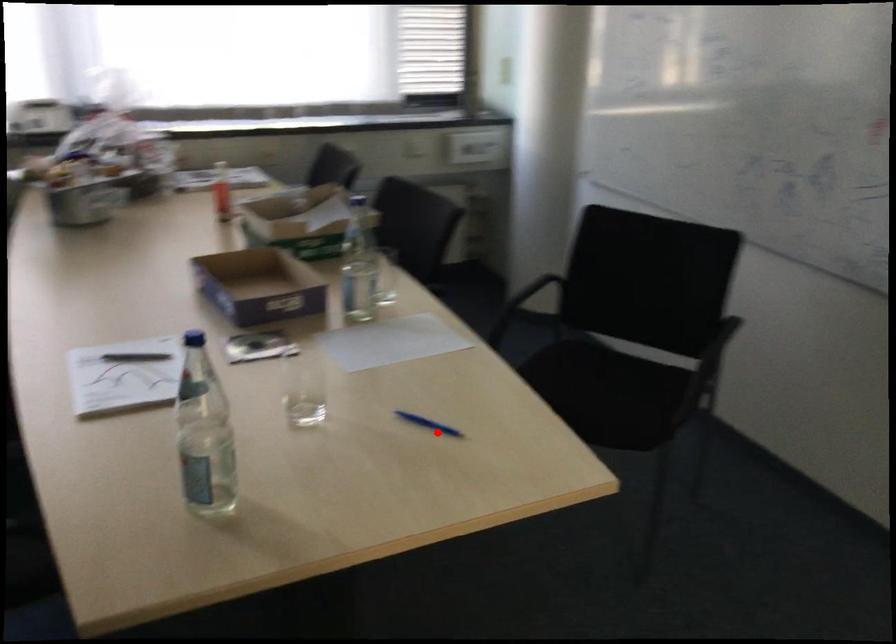
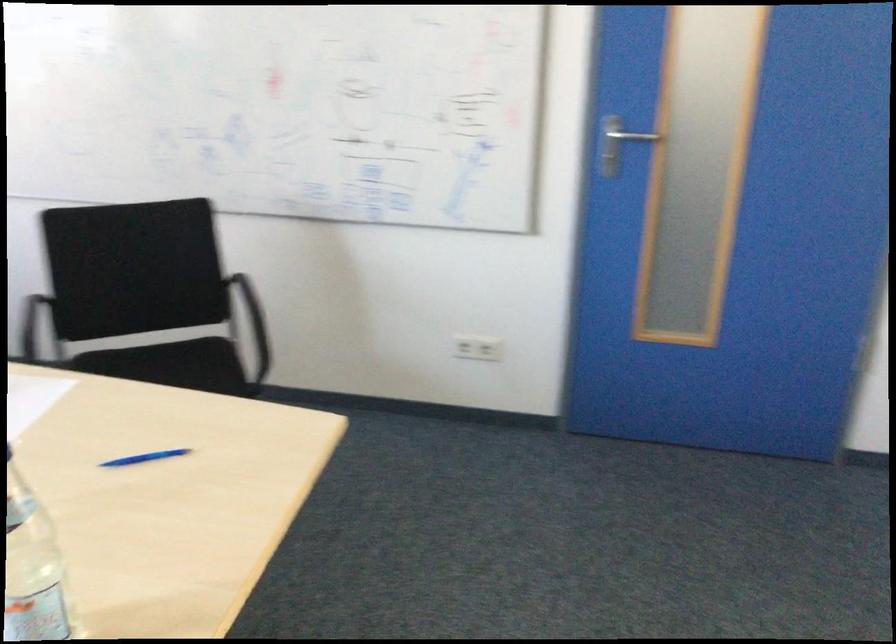
In the second image, find the point that corresponds to the highlighted location in the first image.

(143, 458)